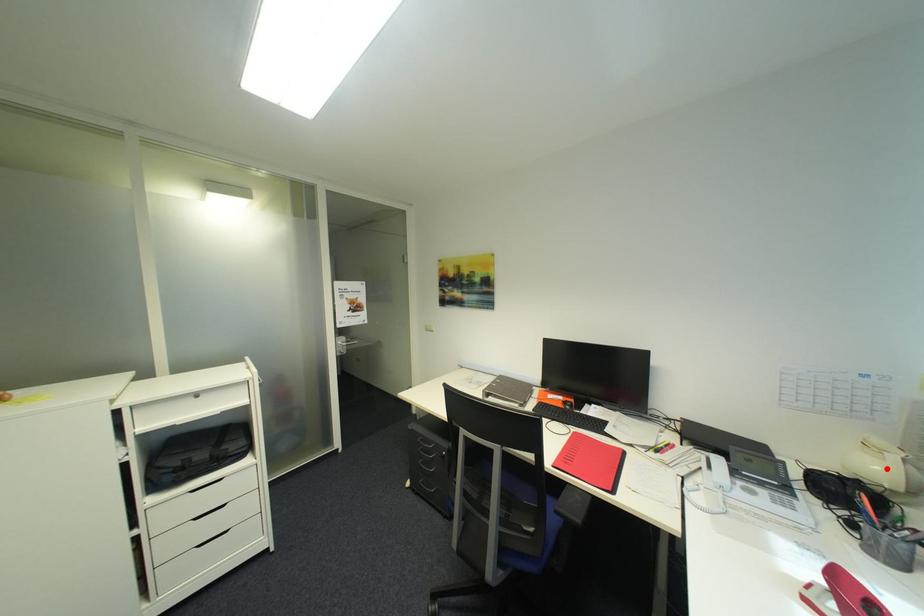
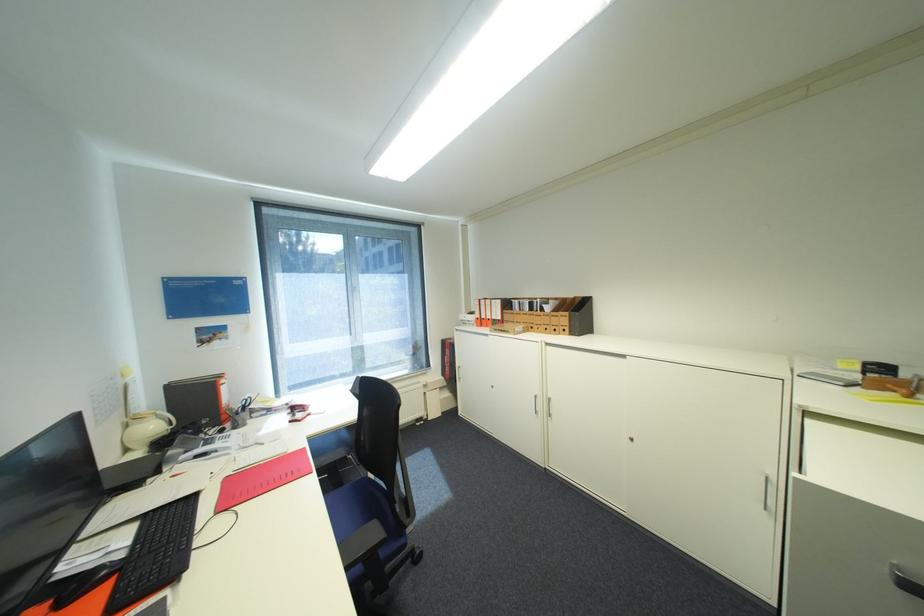
The point at the highlighted location is marked in the first image. Where is the corresponding point in the second image?

(161, 427)